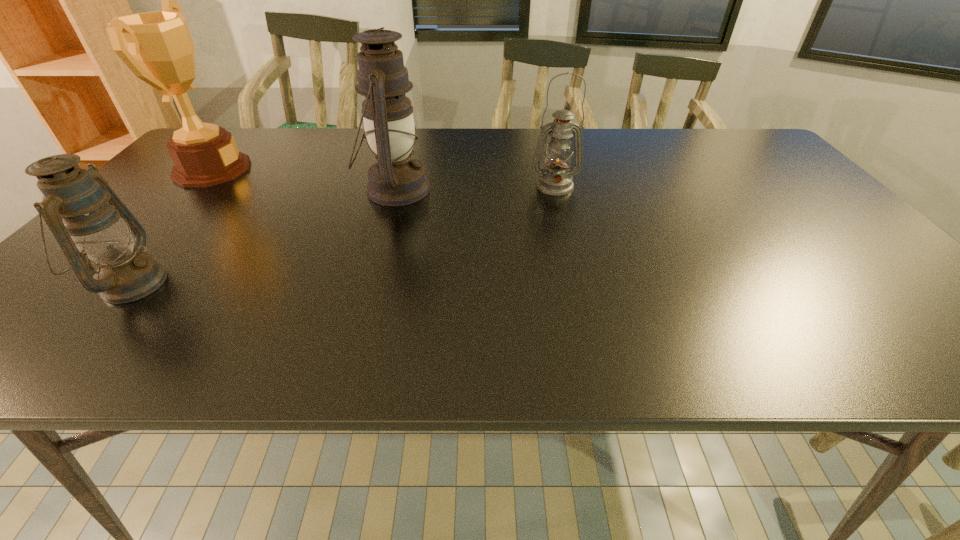
Locate an element on the screen. unoccupied position between the second oil lamp from left to right and the rightmost oil lamp is located at coordinates (474, 188).

Image resolution: width=960 pixels, height=540 pixels. In order to click on empty space between the second oil lamp from left to right and the leftmost oil lamp in this screenshot , I will do `click(263, 237)`.

Where is `free space between the leftmost oil lamp and the award`? free space between the leftmost oil lamp and the award is located at coordinates (172, 226).

In order to click on free space between the award and the tallest oil lamp in this screenshot , I will do `click(303, 179)`.

Identify the location of vacant space in between the second oil lamp from left to right and the leftmost oil lamp. The height and width of the screenshot is (540, 960). (263, 237).

The width and height of the screenshot is (960, 540). I want to click on empty space that is in between the award and the second oil lamp from left to right, so click(x=303, y=179).

You are a GUI agent. You are given a task and a screenshot of the screen. Output one action in this format:
    pyautogui.click(x=<x>, y=<y>)
    Task: Click on the vacant space that's between the award and the nearest object
    This screenshot has width=960, height=540.
    Given the screenshot: What is the action you would take?
    pyautogui.click(x=172, y=226)

Locate which object is the second closest to the rightmost object. Please provide its 2D coordinates. Your answer should be formatted as a tuple, i.e. [(x, y)], where the tuple contains the x and y coordinates of a point satisfying the conditions above.

[(157, 46)]

Select which object is the third closest to the leftmost oil lamp. Please provide its 2D coordinates. Your answer should be formatted as a tuple, i.e. [(x, y)], where the tuple contains the x and y coordinates of a point satisfying the conditions above.

[(556, 180)]

Locate which oil lamp is the second closest to the rightmost object. Please provide its 2D coordinates. Your answer should be formatted as a tuple, i.e. [(x, y)], where the tuple contains the x and y coordinates of a point satisfying the conditions above.

[(74, 206)]